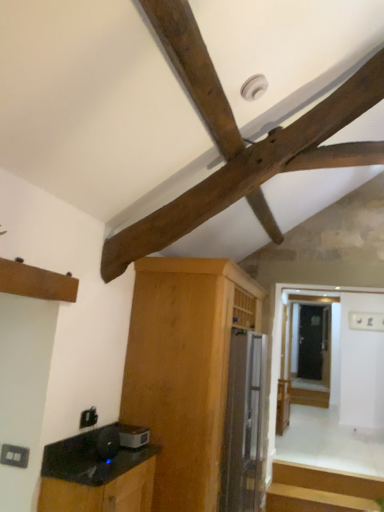
Question: From the image's perspective, is black glossy cabinet at lower left, which is the 1th cabinetry from front to back, beneath satin silver refrigerator at center, which appears as the second appliance when viewed from the left?

Choices:
 (A) no
 (B) yes

Answer: (A)

Question: Is black glossy cabinet at lower left, which is the 1th cabinetry from front to back, smaller than satin silver refrigerator at center, the 2th appliance when ordered from top to bottom?

Choices:
 (A) yes
 (B) no

Answer: (A)

Question: Does black glossy cabinet at lower left, which is the 1th cabinetry from front to back, have a lesser width compared to satin silver refrigerator at center, the 2th appliance when ordered from top to bottom?

Choices:
 (A) no
 (B) yes

Answer: (B)

Question: Is satin silver refrigerator at center, which is the first appliance from back to front, surrounded by black glossy cabinet at lower left, which is counted as the second cabinetry, starting from the back?

Choices:
 (A) yes
 (B) no

Answer: (B)

Question: Does black glossy cabinet at lower left, which is counted as the second cabinetry, starting from the back, have a greater width compared to satin silver refrigerator at center, the 1th appliance ordered from the bottom?

Choices:
 (A) yes
 (B) no

Answer: (B)

Question: Is point (185, 53) positioned closer to the camera than point (77, 486)?

Choices:
 (A) closer
 (B) farther

Answer: (A)

Question: Considering their positions, is dark brown wood at upper center located in front of or behind black glossy cabinet at lower left, which is counted as the second cabinetry, starting from the back?

Choices:
 (A) front
 (B) behind

Answer: (B)

Question: Based on their sizes in the image, would you say dark brown wood at upper center is bigger or smaller than black glossy cabinet at lower left, which is counted as the second cabinetry, starting from the back?

Choices:
 (A) big
 (B) small

Answer: (A)

Question: From a real-world perspective, relative to black glossy cabinet at lower left, which is counted as the second cabinetry, starting from the back, is dark brown wood at upper center vertically above or below?

Choices:
 (A) below
 (B) above

Answer: (B)

Question: In terms of height, does satin silver refrigerator at center, the 2th appliance when ordered from top to bottom, look taller or shorter compared to black glossy cabinet at lower left, which is the 1th cabinetry from front to back?

Choices:
 (A) short
 (B) tall

Answer: (B)

Question: Would you say satin silver refrigerator at center, the 1th appliance ordered from the bottom, is to the left or to the right of black glossy cabinet at lower left, which is the 1th cabinetry from front to back, in the picture?

Choices:
 (A) left
 (B) right

Answer: (B)

Question: Does point (263, 413) appear closer or farther from the camera than point (59, 495)?

Choices:
 (A) farther
 (B) closer

Answer: (A)

Question: From a real-world perspective, relative to black glossy cabinet at lower left, which is the 1th cabinetry from front to back, is satin silver refrigerator at center, which appears as the second appliance when viewed from the left, vertically above or below?

Choices:
 (A) above
 (B) below

Answer: (A)

Question: From the image's perspective, is light brown wood cabinet at center, acting as the 2th cabinetry starting from the front, positioned above or below black glossy cabinet at lower left, which is counted as the second cabinetry, starting from the back?

Choices:
 (A) above
 (B) below

Answer: (A)

Question: Considering the positions of point (216, 429) and point (144, 506), is point (216, 429) closer or farther from the camera than point (144, 506)?

Choices:
 (A) farther
 (B) closer

Answer: (A)